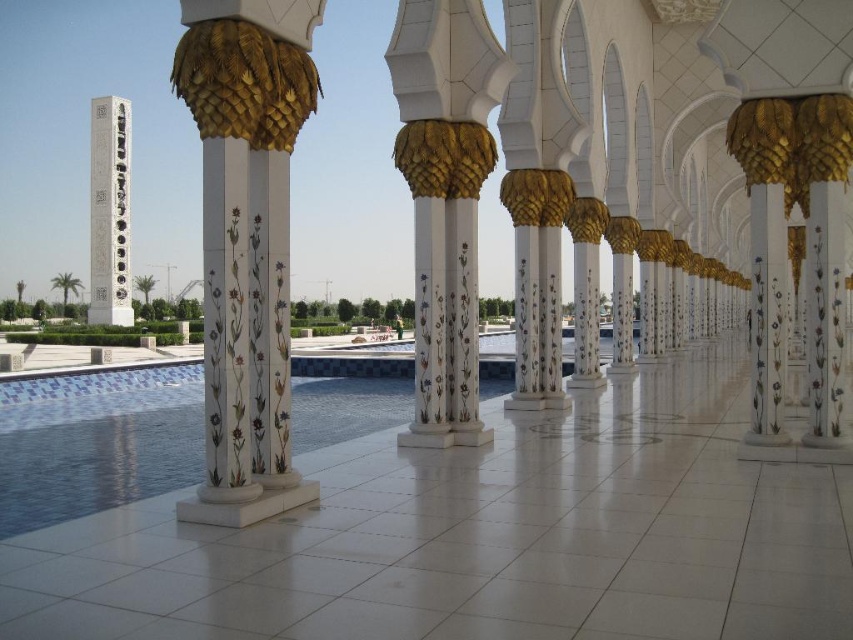
Question: Which of the following is the closest to the observer?

Choices:
 (A) white glossy column at center
 (B) white marble pillar at center
 (C) white marble column at left

Answer: (A)

Question: Is white glossy column at center to the left of white marble pillar at center from the viewer's perspective?

Choices:
 (A) yes
 (B) no

Answer: (A)

Question: Is white glossy column at center to the right of white marble column at left from the viewer's perspective?

Choices:
 (A) no
 (B) yes

Answer: (B)

Question: Among these points, which one is nearest to the camera?

Choices:
 (A) (107, 170)
 (B) (469, 253)
 (C) (236, 436)

Answer: (C)

Question: Can you confirm if white marble pillar at center is positioned to the right of white marble column at left?

Choices:
 (A) yes
 (B) no

Answer: (A)

Question: Among these points, which one is nearest to the camera?

Choices:
 (A) click(x=102, y=298)
 (B) click(x=227, y=355)

Answer: (B)